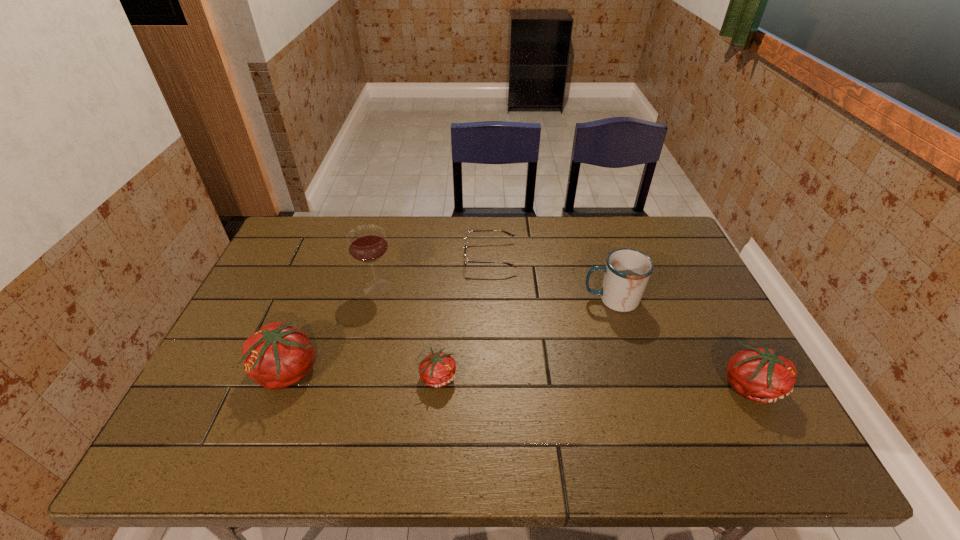
Image resolution: width=960 pixels, height=540 pixels. In order to click on object at the far edge in this screenshot , I will do `click(466, 261)`.

Where is `object that is at the left edge`? The width and height of the screenshot is (960, 540). object that is at the left edge is located at coordinates (277, 356).

Image resolution: width=960 pixels, height=540 pixels. In order to click on object that is positioned at the right edge in this screenshot , I will do `click(762, 375)`.

Find the location of `object situated at the near left corner`. object situated at the near left corner is located at coordinates (277, 356).

Identify the location of object that is at the near right corner. The width and height of the screenshot is (960, 540). (762, 375).

Find the location of `free space at the far edge`. free space at the far edge is located at coordinates (588, 229).

The image size is (960, 540). In the image, there is a desktop. What are the coordinates of `blank space at the near edge` in the screenshot? It's located at (382, 416).

Where is `vacant space at the left edge of the desktop`? vacant space at the left edge of the desktop is located at coordinates (243, 338).

Where is `vacant space at the right edge of the desktop`? vacant space at the right edge of the desktop is located at coordinates (676, 316).

What are the coordinates of `free area in between the fourth object from left to right and the fourth object from right to left` in the screenshot? It's located at (465, 316).